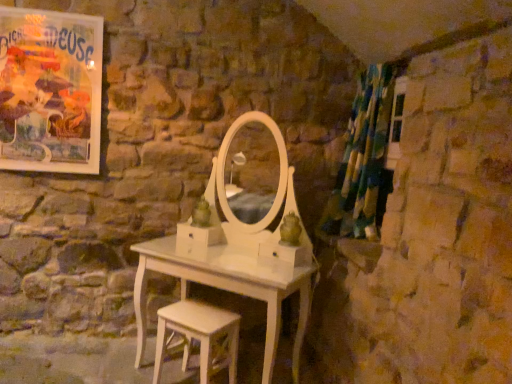
Question: Does white wood stool at lower center have a greater height compared to matte paper poster at upper left?

Choices:
 (A) yes
 (B) no

Answer: (B)

Question: Is white wood stool at lower center touching matte paper poster at upper left?

Choices:
 (A) no
 (B) yes

Answer: (A)

Question: From a real-world perspective, is white wood stool at lower center under matte paper poster at upper left?

Choices:
 (A) no
 (B) yes

Answer: (B)

Question: Does white wood stool at lower center have a lesser width compared to matte paper poster at upper left?

Choices:
 (A) no
 (B) yes

Answer: (A)

Question: Is the position of white wood stool at lower center less distant than that of matte paper poster at upper left?

Choices:
 (A) no
 (B) yes

Answer: (B)

Question: Based on their positions, is green and blue fabric shower curtain at right located to the left or right of matte paper poster at upper left?

Choices:
 (A) left
 (B) right

Answer: (B)

Question: From a real-world perspective, is green and blue fabric shower curtain at right above or below matte paper poster at upper left?

Choices:
 (A) above
 (B) below

Answer: (B)

Question: Is green and blue fabric shower curtain at right situated inside matte paper poster at upper left or outside?

Choices:
 (A) outside
 (B) inside

Answer: (A)

Question: Is point (376, 140) positioned closer to the camera than point (10, 76)?

Choices:
 (A) farther
 (B) closer

Answer: (A)

Question: Considering the relative positions of matte paper poster at upper left and white wood stool at lower center in the image provided, is matte paper poster at upper left to the left or to the right of white wood stool at lower center?

Choices:
 (A) right
 (B) left

Answer: (B)

Question: Considering the positions of matte paper poster at upper left and white wood stool at lower center in the image, is matte paper poster at upper left bigger or smaller than white wood stool at lower center?

Choices:
 (A) big
 (B) small

Answer: (B)

Question: From a real-world perspective, relative to white wood stool at lower center, is matte paper poster at upper left vertically above or below?

Choices:
 (A) above
 (B) below

Answer: (A)

Question: From the image's perspective, relative to white wood stool at lower center, is matte paper poster at upper left above or below?

Choices:
 (A) above
 (B) below

Answer: (A)

Question: Does point (157, 342) appear closer or farther from the camera than point (5, 13)?

Choices:
 (A) farther
 (B) closer

Answer: (B)

Question: Which is correct: white wood stool at lower center is inside matte paper poster at upper left, or outside of it?

Choices:
 (A) inside
 (B) outside

Answer: (B)